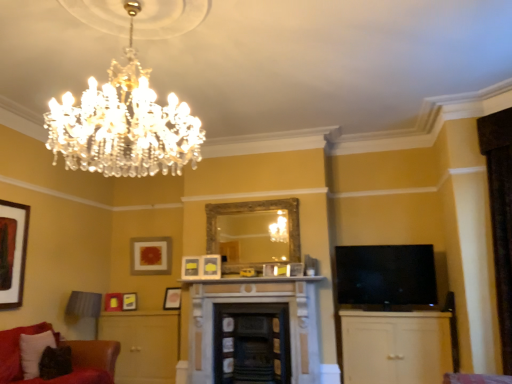
Question: Is the depth of dark gray stone fireplace at center, the 2th fireplace in the right-to-left sequence, greater than that of matte gold picture frame at center, which is the fifth picture frame in left-to-right order?

Choices:
 (A) yes
 (B) no

Answer: (B)

Question: From a real-world perspective, is dark gray stone fireplace at center, which is the 1th fireplace from left to right, on top of matte gold picture frame at center, acting as the fourth picture frame starting from the back?

Choices:
 (A) yes
 (B) no

Answer: (B)

Question: Is dark gray stone fireplace at center, the 2th fireplace in the right-to-left sequence, bigger than matte gold picture frame at center, acting as the 5th picture frame starting from the front?

Choices:
 (A) yes
 (B) no

Answer: (A)

Question: Considering the relative positions of dark gray stone fireplace at center, the 2th fireplace in the right-to-left sequence, and matte gold picture frame at center, the fourth picture frame from the right, in the image provided, is dark gray stone fireplace at center, the 2th fireplace in the right-to-left sequence, to the left of matte gold picture frame at center, the fourth picture frame from the right, from the viewer's perspective?

Choices:
 (A) yes
 (B) no

Answer: (B)

Question: Is matte gold picture frame at center, acting as the fourth picture frame starting from the back, inside dark gray stone fireplace at center, which is the 1th fireplace from left to right?

Choices:
 (A) yes
 (B) no

Answer: (B)

Question: Is dark gray stone fireplace at center, the 2th fireplace in the right-to-left sequence, far from matte gold picture frame at center, acting as the 5th picture frame starting from the front?

Choices:
 (A) no
 (B) yes

Answer: (B)

Question: Would you say velvet dark brown pillow at lower left is part of matte gold picture frame at center, acting as the 5th picture frame starting from the front,'s contents?

Choices:
 (A) yes
 (B) no

Answer: (B)

Question: Is matte gold picture frame at center, the fourth picture frame from the right, taller than velvet dark brown pillow at lower left?

Choices:
 (A) yes
 (B) no

Answer: (B)

Question: Is matte gold picture frame at center, the fourth picture frame from the right, further to the viewer compared to velvet dark brown pillow at lower left?

Choices:
 (A) yes
 (B) no

Answer: (A)

Question: Is matte gold picture frame at center, which is the fifth picture frame in left-to-right order, shorter than velvet dark brown pillow at lower left?

Choices:
 (A) yes
 (B) no

Answer: (A)

Question: Can you confirm if matte gold picture frame at center, which is the fifth picture frame in left-to-right order, is positioned to the left of velvet dark brown pillow at lower left?

Choices:
 (A) no
 (B) yes

Answer: (A)

Question: From a real-world perspective, is matte gold picture frame at center, acting as the fourth picture frame starting from the back, under velvet dark brown pillow at lower left?

Choices:
 (A) yes
 (B) no

Answer: (B)

Question: Can white marble fireplace at center be found inside velvet red couch at lower left?

Choices:
 (A) no
 (B) yes

Answer: (A)